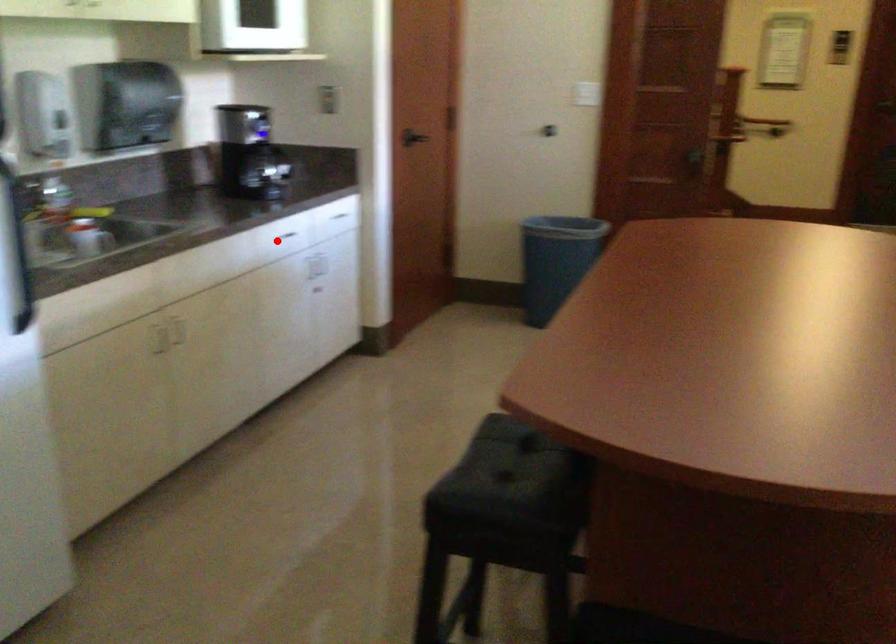
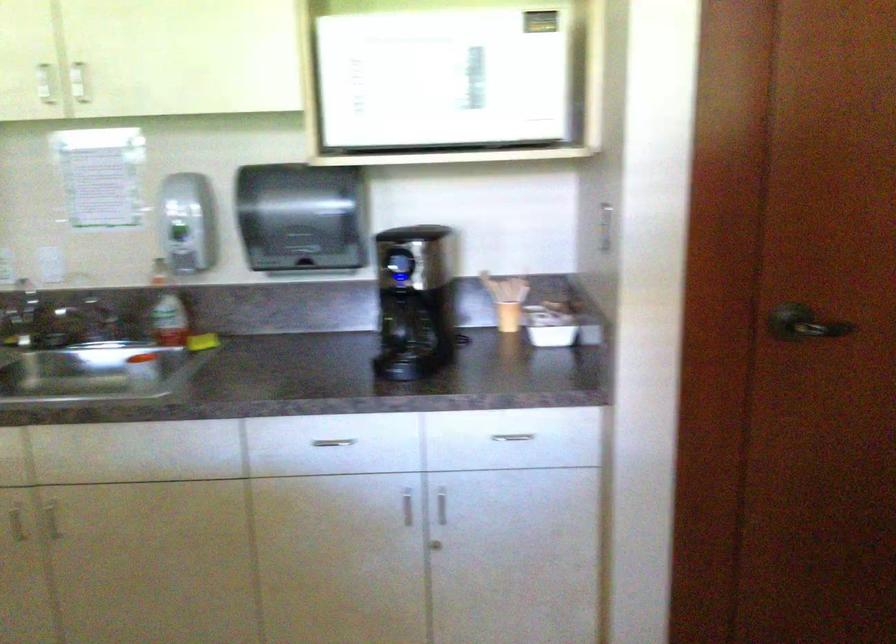
The point at the highlighted location is marked in the first image. Where is the corresponding point in the second image?

(332, 442)